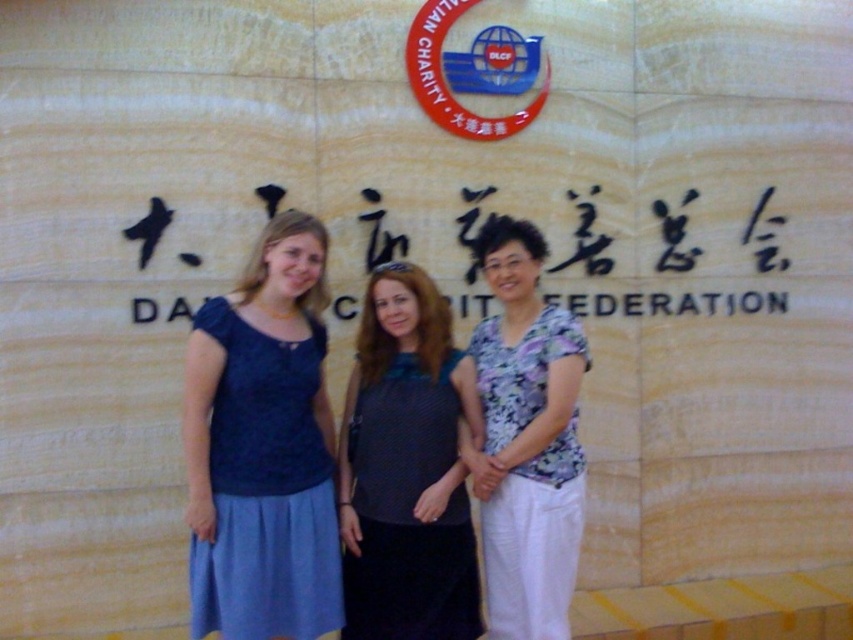
Question: Considering the real-world distances, which object is closest to the matte gray top at center?

Choices:
 (A) floral fabric blouse at center
 (B) red glossy logo at upper center

Answer: (A)

Question: Can you confirm if matte gray top at center is positioned below red glossy logo at upper center?

Choices:
 (A) no
 (B) yes

Answer: (B)

Question: In this image, where is matte gray top at center located relative to floral fabric blouse at center?

Choices:
 (A) right
 (B) left

Answer: (B)

Question: Is blue satin dress at left further to the viewer compared to matte gray top at center?

Choices:
 (A) yes
 (B) no

Answer: (B)

Question: Among these objects, which one is nearest to the camera?

Choices:
 (A) matte gray top at center
 (B) red glossy logo at upper center
 (C) floral fabric blouse at center

Answer: (C)

Question: Which of the following is the farthest from the observer?

Choices:
 (A) red glossy logo at upper center
 (B) matte gray top at center

Answer: (A)